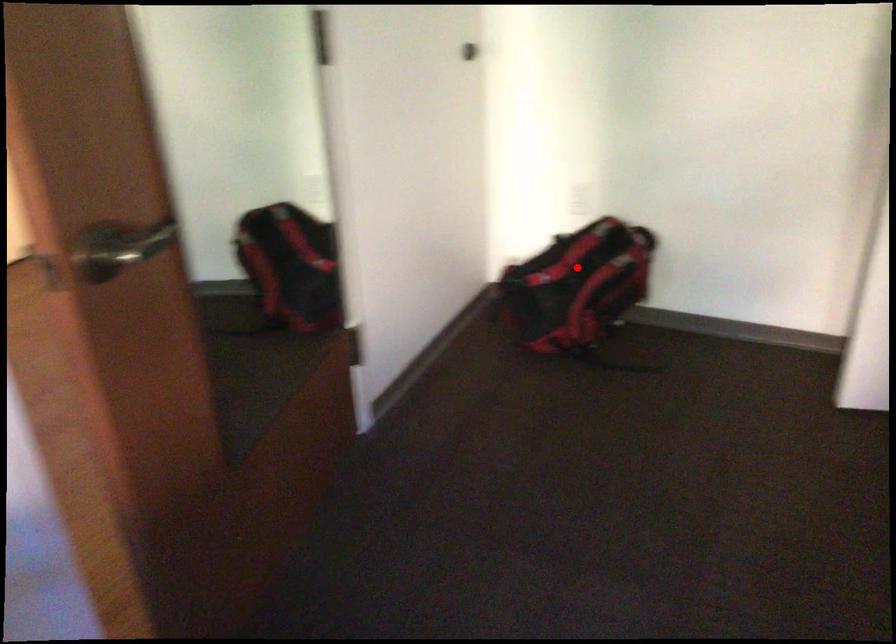
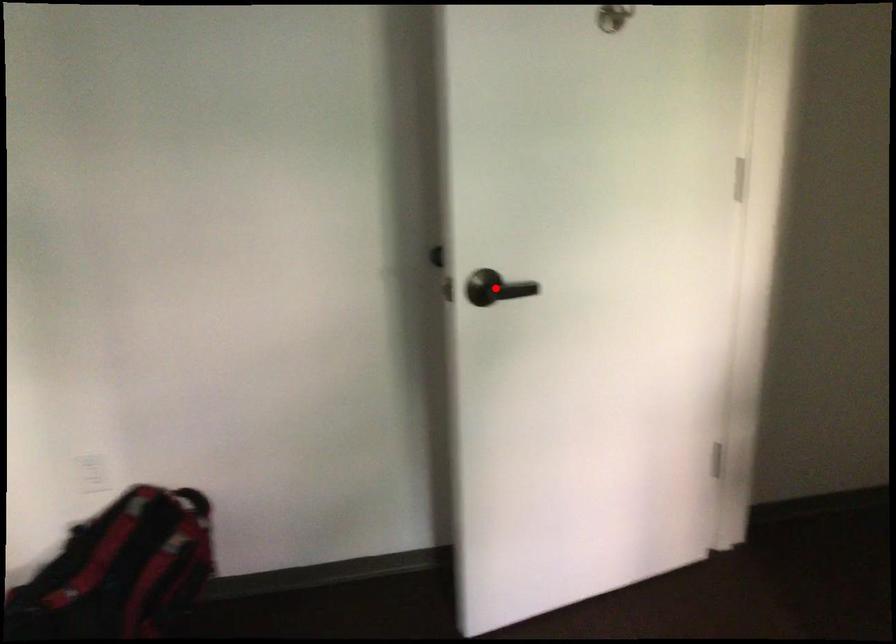
I am providing you with two images of the same scene from different viewpoints. A red point is marked on the first image and another point is marked on the second image. Is the marked point in image1 the same physical position as the marked point in image2?

No